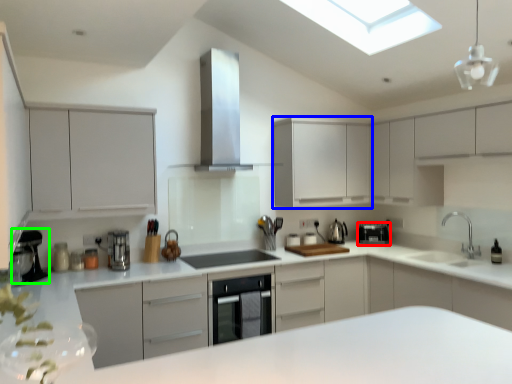
Question: Estimate the real-world distances between objects in this image. Which object is farther from kitchen appliance (highlighted by a red box), cabinetry (highlighted by a blue box) or coffee machine (highlighted by a green box)?

Choices:
 (A) cabinetry
 (B) coffee machine

Answer: (B)